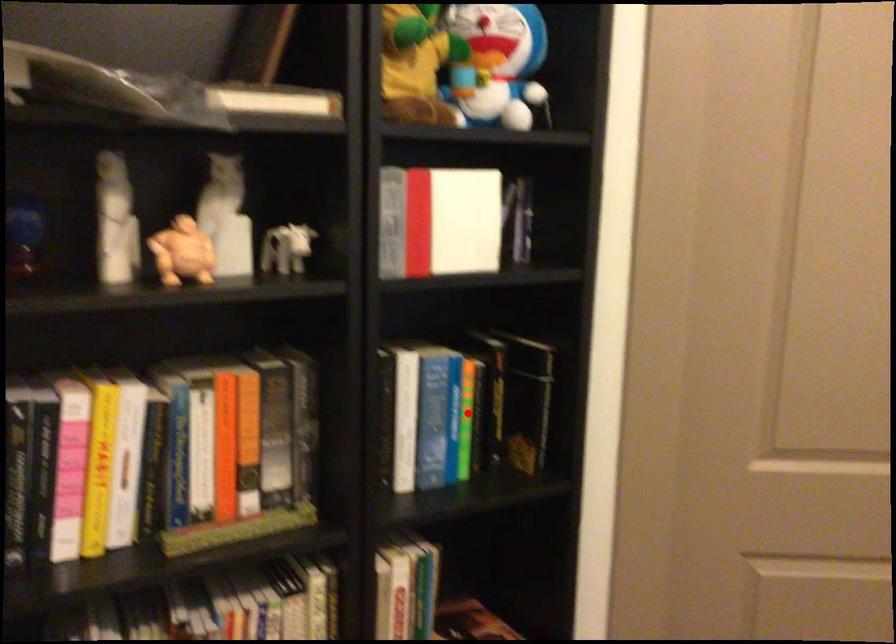
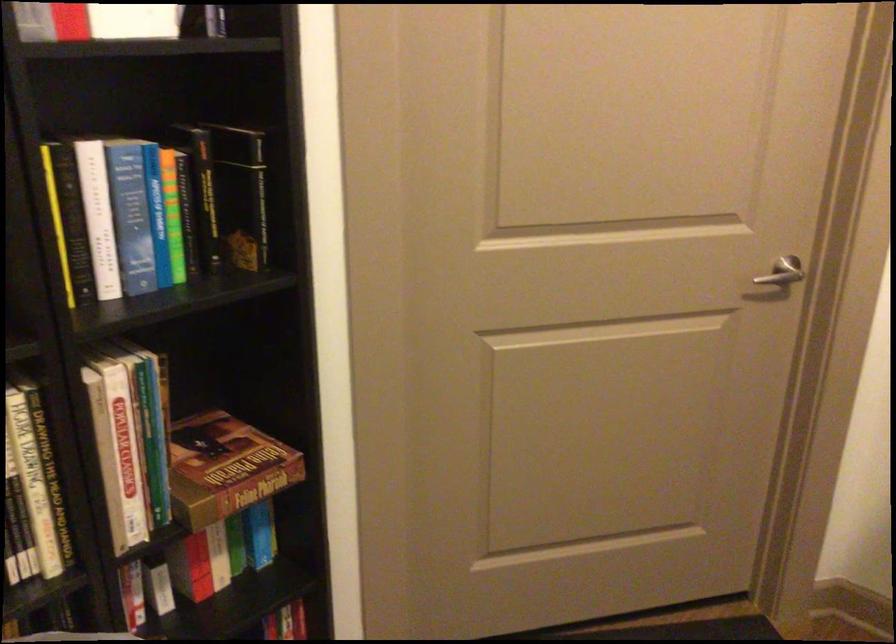
In the second image, find the point that corresponds to the highlighted location in the first image.

(171, 214)